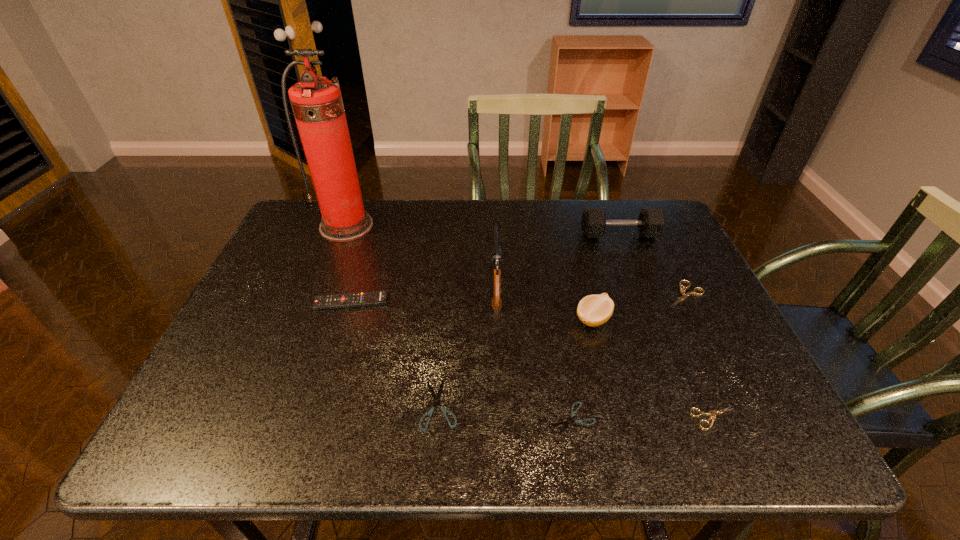
Image resolution: width=960 pixels, height=540 pixels. What are the coordinates of `the leftmost shears` in the screenshot? It's located at (436, 398).

This screenshot has height=540, width=960. In order to click on the left black shears in this screenshot , I will do `click(436, 398)`.

This screenshot has height=540, width=960. Identify the location of the shortest shears. click(x=566, y=423).

This screenshot has height=540, width=960. Find the location of `the third shears from right to left`. the third shears from right to left is located at coordinates (566, 423).

At what (x,y) coordinates should I click in order to perform the action: click on free location located 0.300m at the discharge end of the tallest object. Please return your answer as a coordinate pair (x, y). The width and height of the screenshot is (960, 540). Looking at the image, I should click on (311, 318).

The width and height of the screenshot is (960, 540). I want to click on vacant space situated 0.240m along the barrel of the second tallest object, so click(492, 211).

Where is `free region located along the barrel of the second tallest object`? This screenshot has width=960, height=540. free region located along the barrel of the second tallest object is located at coordinates (493, 218).

Find the location of a particular element. This screenshot has width=960, height=540. free location located along the barrel of the second tallest object is located at coordinates 493,218.

Locate an element on the screen. vacant region located on the front of the third tallest object is located at coordinates (664, 354).

Locate an element on the screen. vacant region located on the front of the yellow lemon is located at coordinates (613, 402).